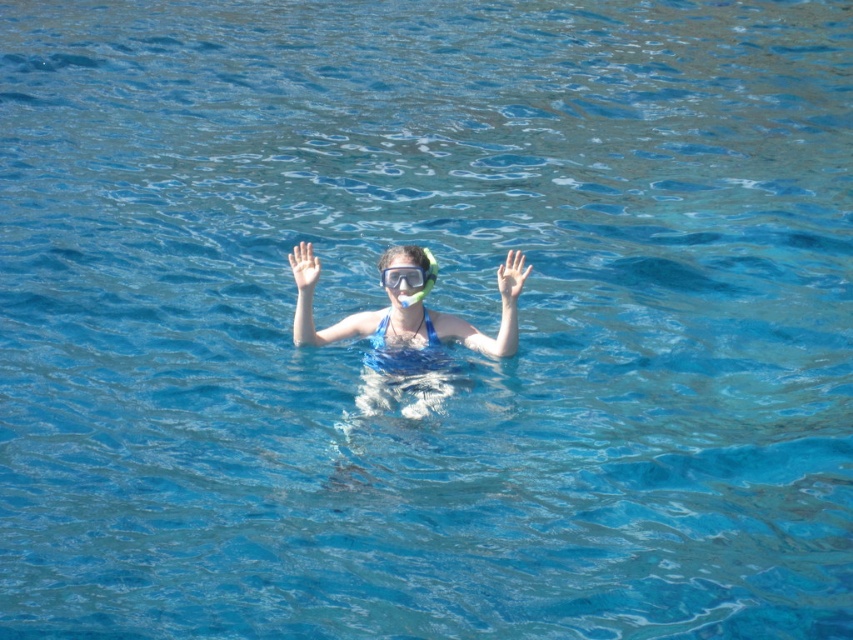
Between matte blue swimsuit at center and transparent rubber hand at center, which one appears on the right side from the viewer's perspective?

From the viewer's perspective, transparent rubber hand at center appears more on the right side.

In the scene shown: Can you confirm if matte blue swimsuit at center is bigger than transparent rubber hand at center?

Yes, matte blue swimsuit at center is bigger than transparent rubber hand at center.

Is point (370, 348) less distant than point (509, 305)?

No, it is not.

This screenshot has height=640, width=853. I want to click on matte blue swimsuit at center, so click(405, 349).

Does matte blue swimsuit at center have a greater width compared to white matte hand at center?

Yes.

Does point (311, 330) lie behind point (305, 262)?

Yes.

Is point (384, 396) more distant than point (318, 259)?

That is False.

At what (x,y) coordinates should I click in order to perform the action: click on matte blue swimsuit at center. Please return your answer as a coordinate pair (x, y). This screenshot has height=640, width=853. Looking at the image, I should click on (405, 349).

Is matte blue swimsuit at center in front of clear plastic goggles at center?

Answer: That is True.

Where is `matte blue swimsuit at center`? matte blue swimsuit at center is located at coordinates (405, 349).

At what (x,y) coordinates should I click in order to perform the action: click on matte blue swimsuit at center. Please return your answer as a coordinate pair (x, y). This screenshot has height=640, width=853. Looking at the image, I should click on (405, 349).